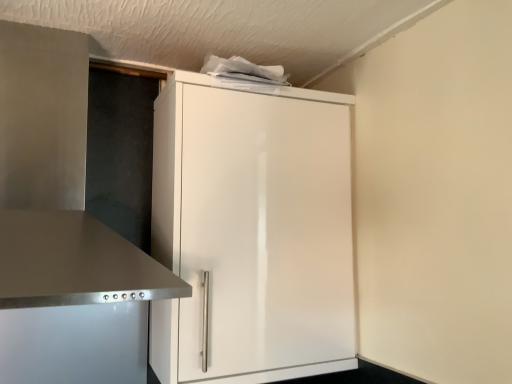
Question: Is stainless steel vent at left surrounding white glossy cupboard at center?

Choices:
 (A) no
 (B) yes

Answer: (A)

Question: Is white glossy cupboard at center at the back of stainless steel vent at left?

Choices:
 (A) yes
 (B) no

Answer: (B)

Question: Does stainless steel vent at left have a smaller size compared to white glossy cupboard at center?

Choices:
 (A) yes
 (B) no

Answer: (A)

Question: Is stainless steel vent at left bigger than white glossy cupboard at center?

Choices:
 (A) no
 (B) yes

Answer: (A)

Question: From the image's perspective, would you say stainless steel vent at left is shown under white glossy cupboard at center?

Choices:
 (A) no
 (B) yes

Answer: (A)

Question: Is stainless steel vent at left completely or partially outside of white glossy cupboard at center?

Choices:
 (A) yes
 (B) no

Answer: (A)

Question: Considering the relative sizes of white glossy cupboard at center and stainless steel vent at left in the image provided, is white glossy cupboard at center thinner than stainless steel vent at left?

Choices:
 (A) no
 (B) yes

Answer: (B)

Question: Considering the relative sizes of white glossy cupboard at center and stainless steel vent at left in the image provided, is white glossy cupboard at center taller than stainless steel vent at left?

Choices:
 (A) no
 (B) yes

Answer: (B)

Question: Is the depth of white glossy cupboard at center greater than that of stainless steel vent at left?

Choices:
 (A) no
 (B) yes

Answer: (B)

Question: Does white glossy cupboard at center turn towards stainless steel vent at left?

Choices:
 (A) no
 (B) yes

Answer: (A)

Question: From a real-world perspective, is white glossy cupboard at center physically below stainless steel vent at left?

Choices:
 (A) yes
 (B) no

Answer: (A)

Question: From the image's perspective, would you say white glossy cupboard at center is positioned over stainless steel vent at left?

Choices:
 (A) yes
 (B) no

Answer: (B)

Question: From the image's perspective, is stainless steel vent at left above or below white glossy cupboard at center?

Choices:
 (A) below
 (B) above

Answer: (B)